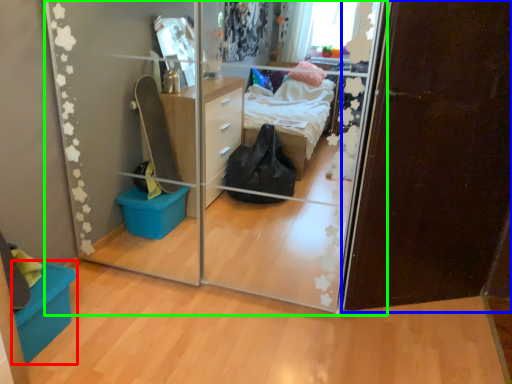
Question: Which object is positioned farthest from storage box (highlighted by a red box)? Select from door (highlighted by a blue box) and glass door (highlighted by a green box).

Choices:
 (A) door
 (B) glass door

Answer: (A)